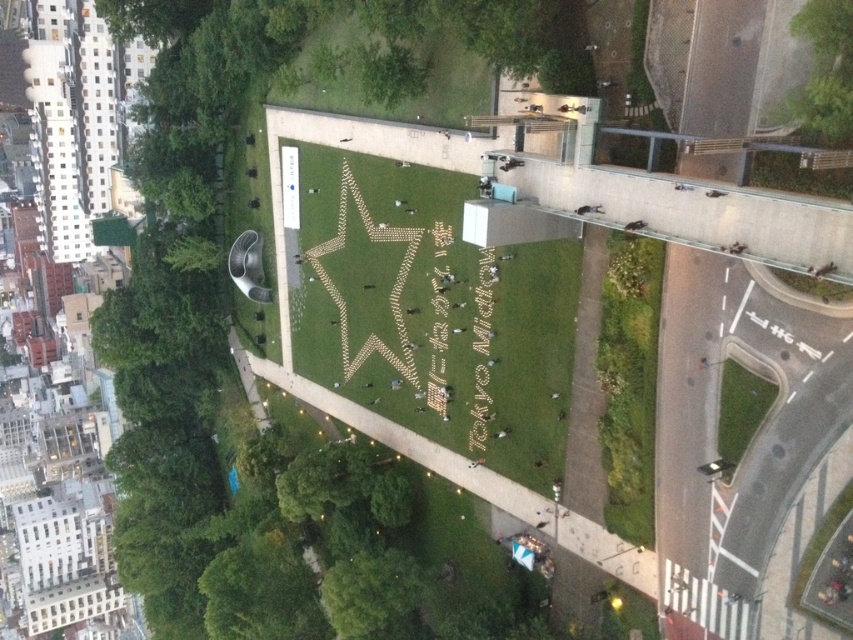
Question: Considering the relative positions of green leafy tree at lower left and green grass at lower right in the image provided, where is green leafy tree at lower left located with respect to green grass at lower right?

Choices:
 (A) above
 (B) below

Answer: (B)

Question: Which of these objects is positioned farthest from the green leafy tree at lower center?

Choices:
 (A) green grass at center
 (B) green leafy tree at lower left
 (C) green grass at lower right

Answer: (C)

Question: Can you confirm if green grass at center is positioned below green grass at lower right?

Choices:
 (A) yes
 (B) no

Answer: (B)

Question: Which of the following is the closest to the observer?

Choices:
 (A) green grass at center
 (B) green leafy tree at lower left

Answer: (A)

Question: Does green leafy tree at lower left appear on the left side of green grass at lower right?

Choices:
 (A) yes
 (B) no

Answer: (A)

Question: Which point is farther to the camera?

Choices:
 (A) green grass at center
 (B) green grass at lower right
 (C) green leafy tree at lower center
 (D) green leafy tree at lower left

Answer: (D)